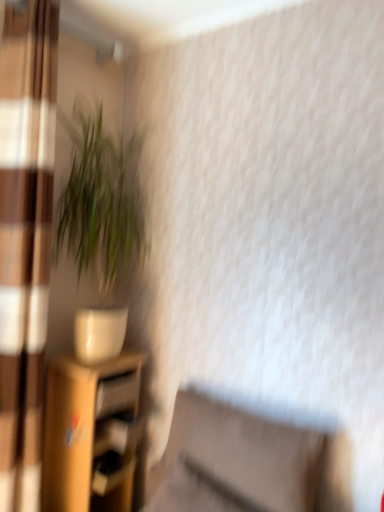
Question: Is matte brown swivel chair at lower center facing towards wooden drawer at lower left?

Choices:
 (A) yes
 (B) no

Answer: (B)

Question: Considering the relative positions of matte brown swivel chair at lower center and wooden drawer at lower left in the image provided, is matte brown swivel chair at lower center in front of wooden drawer at lower left?

Choices:
 (A) no
 (B) yes

Answer: (B)

Question: Is matte brown swivel chair at lower center not inside wooden drawer at lower left?

Choices:
 (A) yes
 (B) no

Answer: (A)

Question: Would you consider matte brown swivel chair at lower center to be distant from wooden drawer at lower left?

Choices:
 (A) no
 (B) yes

Answer: (A)

Question: Is matte brown swivel chair at lower center facing away from wooden drawer at lower left?

Choices:
 (A) yes
 (B) no

Answer: (B)

Question: From their relative heights in the image, would you say wooden shelf at lower left is taller or shorter than green leafy plant at left?

Choices:
 (A) tall
 (B) short

Answer: (B)

Question: In terms of width, does wooden shelf at lower left look wider or thinner when compared to green leafy plant at left?

Choices:
 (A) thin
 (B) wide

Answer: (B)

Question: Considering their positions, is wooden shelf at lower left located in front of or behind green leafy plant at left?

Choices:
 (A) behind
 (B) front

Answer: (A)

Question: Based on their sizes in the image, would you say wooden shelf at lower left is bigger or smaller than green leafy plant at left?

Choices:
 (A) small
 (B) big

Answer: (B)

Question: Does point (190, 485) appear closer or farther from the camera than point (46, 223)?

Choices:
 (A) closer
 (B) farther

Answer: (A)

Question: In terms of height, does matte brown swivel chair at lower center look taller or shorter compared to matte brown curtain at left?

Choices:
 (A) tall
 (B) short

Answer: (B)

Question: In the image, is matte brown swivel chair at lower center on the left side or the right side of matte brown curtain at left?

Choices:
 (A) left
 (B) right

Answer: (B)

Question: From the image's perspective, is matte brown swivel chair at lower center above or below matte brown curtain at left?

Choices:
 (A) below
 (B) above

Answer: (A)

Question: From a real-world perspective, is matte brown curtain at left physically located above or below wooden drawer at lower left?

Choices:
 (A) above
 (B) below

Answer: (A)

Question: Would you say matte brown curtain at left is inside or outside wooden drawer at lower left?

Choices:
 (A) inside
 (B) outside

Answer: (B)